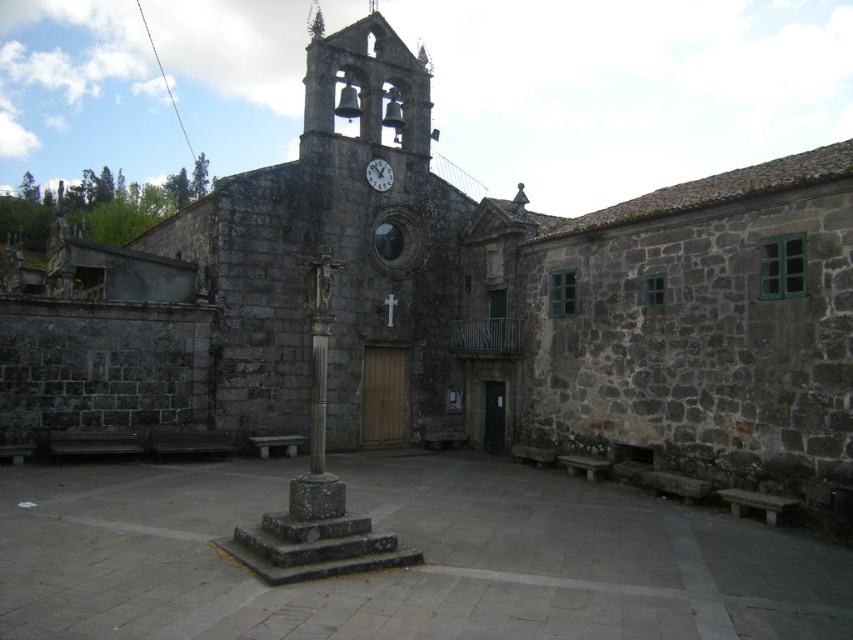
Question: Does gray stone column at center appear over white glossy clock at upper center?

Choices:
 (A) no
 (B) yes

Answer: (A)

Question: Can you confirm if gray stone column at center is positioned above white glossy clock at upper center?

Choices:
 (A) no
 (B) yes

Answer: (A)

Question: Which object appears closest to the camera in this image?

Choices:
 (A) white glossy clock at upper center
 (B) gray stone column at center

Answer: (B)

Question: From the image, what is the correct spatial relationship of gray stone column at center in relation to white glossy clock at upper center?

Choices:
 (A) right
 (B) left

Answer: (B)

Question: Which object appears farthest from the camera in this image?

Choices:
 (A) white glossy clock at upper center
 (B) gray stone column at center

Answer: (A)